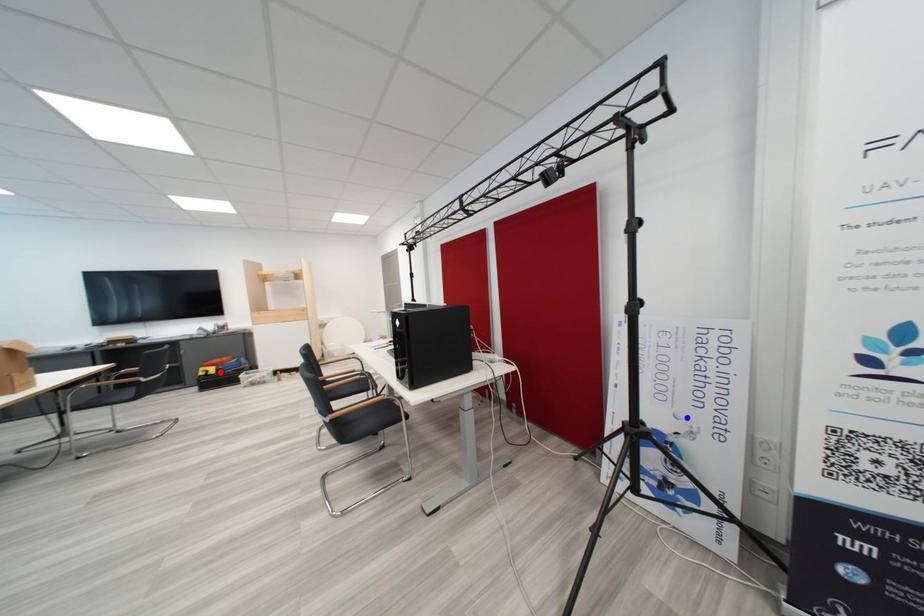
Question: In the image, two points are highlighted. Which point is nearer to the camera? Reply with the corresponding letter.

Choices:
 (A) blue point
 (B) red point

Answer: (A)